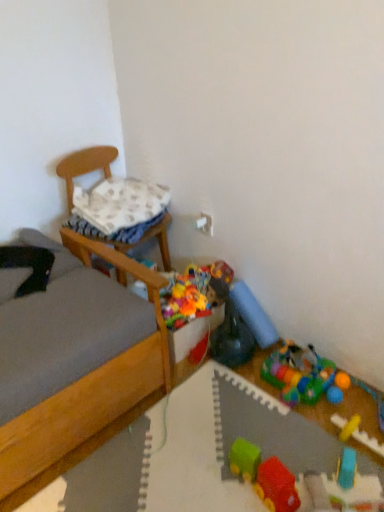
The height and width of the screenshot is (512, 384). Identify the location of free space in front of blue rubber toy at lower right, which is the 3th toy from front to back. (356, 498).